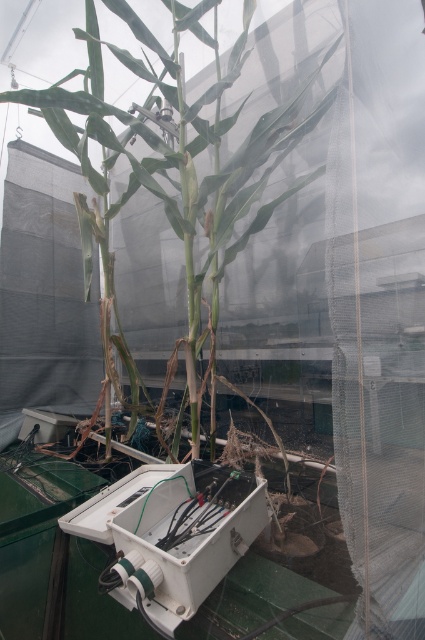
Does point (178, 58) come behind point (130, 596)?

Yes, point (178, 58) is farther from viewer.

Image resolution: width=425 pixels, height=640 pixels. Find the location of `green matte plant at center`. green matte plant at center is located at coordinates (178, 163).